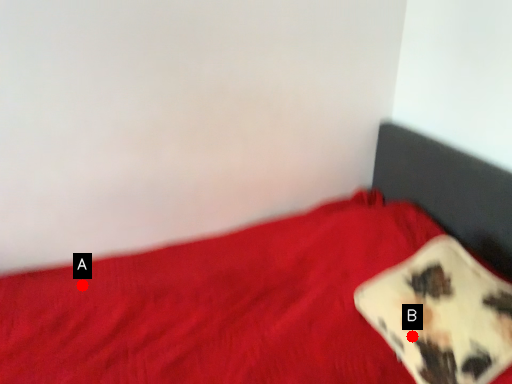
Question: Two points are circled on the image, labeled by A and B beside each circle. Which point is closer to the camera?

Choices:
 (A) A is closer
 (B) B is closer

Answer: (B)